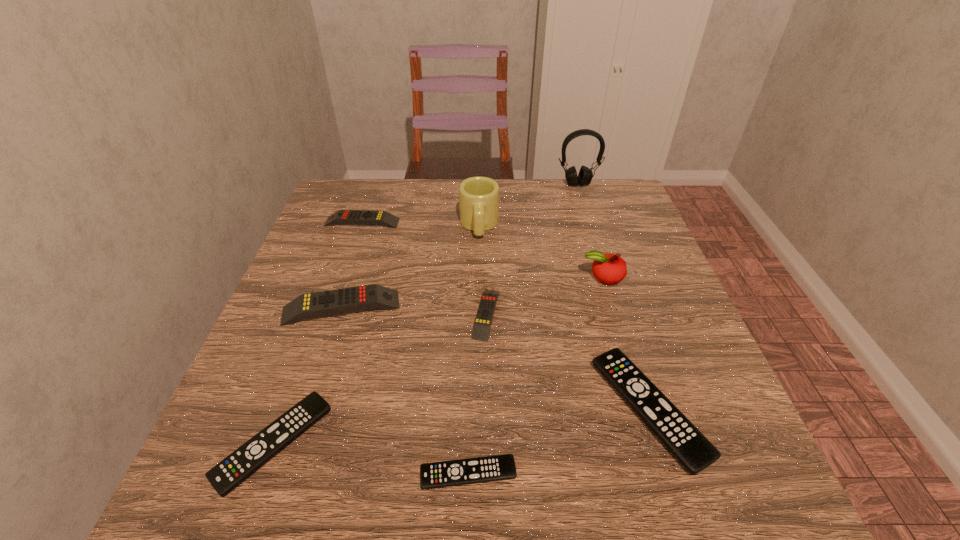
Where is `blank area in the image that satisfies the following two spatial constraints: 1. with the handle on the side of the biggest black remote control; 2. on the left side of the beige mug`? blank area in the image that satisfies the following two spatial constraints: 1. with the handle on the side of the biggest black remote control; 2. on the left side of the beige mug is located at coordinates (479, 409).